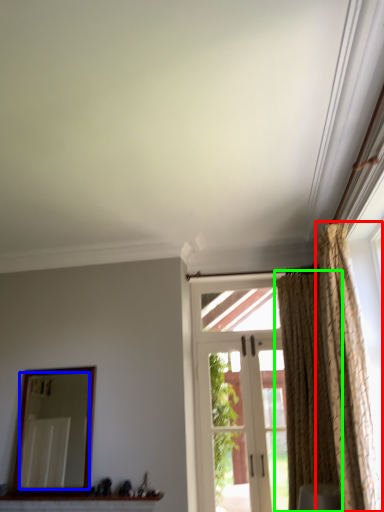
Question: Based on their relative distances, which object is farther from curtain (highlighted by a red box)? Choose from mirror (highlighted by a blue box) and curtain (highlighted by a green box).

Choices:
 (A) mirror
 (B) curtain

Answer: (A)